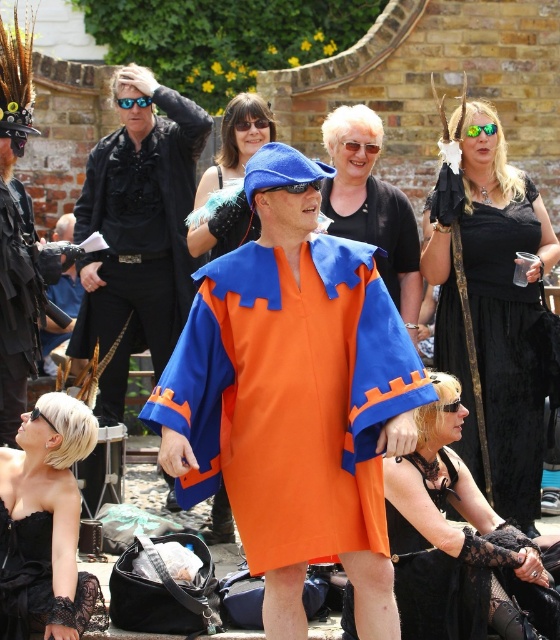
Is black lace strapless dress at lower left further to camera compared to clear plastic goggles at center?

No, it is in front of clear plastic goggles at center.

Between black lace strapless dress at lower left and clear plastic goggles at center, which one appears on the left side from the viewer's perspective?

black lace strapless dress at lower left

Is point (30, 618) positioned in front of point (253, 120)?

That is True.

Locate an element on the screen. This screenshot has width=560, height=640. black lace strapless dress at lower left is located at coordinates (44, 522).

Does black velvet dress at center have a greater width compared to blue plastic goggles at upper center?

Yes, black velvet dress at center is wider than blue plastic goggles at upper center.

Who is taller, black velvet dress at center or blue plastic goggles at upper center?

black velvet dress at center

What do you see at coordinates (506, 310) in the screenshot?
I see `black velvet dress at center` at bounding box center [506, 310].

This screenshot has height=640, width=560. In order to click on black velvet dress at center in this screenshot , I will do `click(506, 310)`.

Does matte black robe at left have a smaller size compared to matte black tank top at center?

Yes.

The image size is (560, 640). What do you see at coordinates (16, 305) in the screenshot?
I see `matte black robe at left` at bounding box center [16, 305].

What are the coordinates of `matte black robe at left` in the screenshot? It's located at (16, 305).